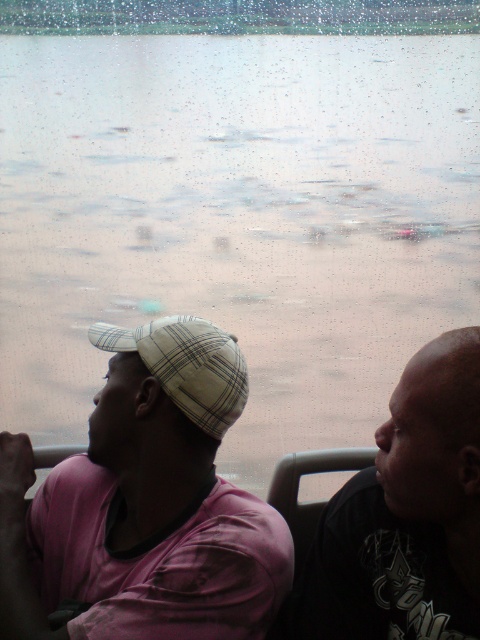
Can you confirm if dark gray matte shirt at right is bigger than plaid fabric baseball cap at left?

Correct, dark gray matte shirt at right is larger in size than plaid fabric baseball cap at left.

Is point (456, 518) less distant than point (130, 333)?

Yes, it is in front of point (130, 333).

The height and width of the screenshot is (640, 480). What are the coordinates of `dark gray matte shirt at right` in the screenshot? It's located at (407, 515).

Does plaid fabric cap at left appear on the right side of plaid fabric baseball cap at left?

In fact, plaid fabric cap at left is to the left of plaid fabric baseball cap at left.

Is plaid fabric cap at left shorter than plaid fabric baseball cap at left?

Incorrect, plaid fabric cap at left's height does not fall short of plaid fabric baseball cap at left's.

Is point (172, 344) positioned before point (206, 321)?

Yes, point (172, 344) is closer to viewer.

Where is `plaid fabric cap at left`? Image resolution: width=480 pixels, height=640 pixels. plaid fabric cap at left is located at coordinates (145, 502).

Based on the photo, who is lower down, plaid fabric cap at left or dark gray matte shirt at right?

dark gray matte shirt at right is lower down.

Which is in front, point (172, 392) or point (437, 552)?

Point (437, 552) is in front.

This screenshot has height=640, width=480. I want to click on plaid fabric cap at left, so click(145, 502).

Where is `plaid fabric cap at left`? This screenshot has width=480, height=640. plaid fabric cap at left is located at coordinates (145, 502).